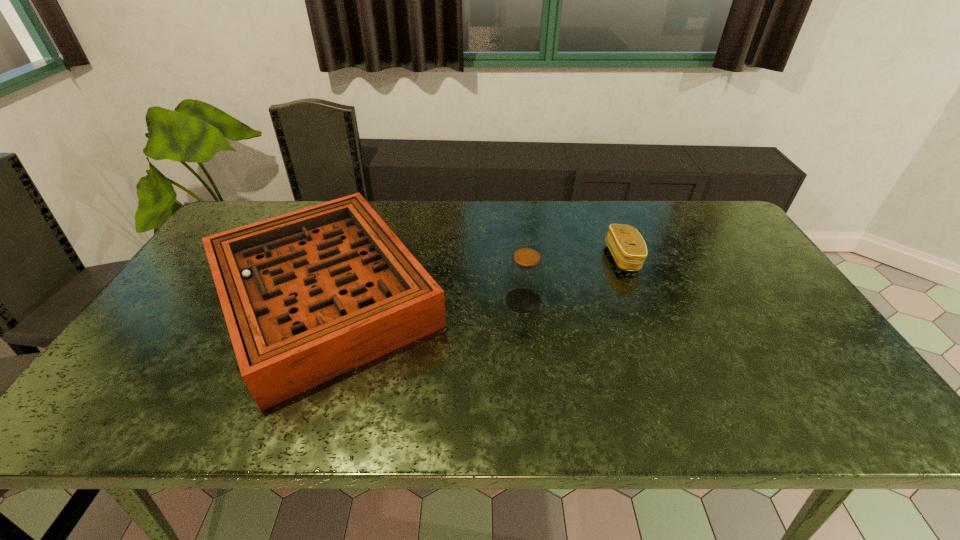
This screenshot has height=540, width=960. Identify the location of jar. (525, 275).

The width and height of the screenshot is (960, 540). What are the coordinates of `the tallest object` in the screenshot? It's located at pos(525,275).

This screenshot has height=540, width=960. Find the location of `the second shortest object`. the second shortest object is located at coordinates (309, 295).

Find the location of `gameboard`. gameboard is located at coordinates (309, 295).

Identify the location of clutch bag. The image size is (960, 540). (626, 244).

Find the location of a particular element. This screenshot has height=540, width=960. the shortest object is located at coordinates coord(626,244).

Find the location of a particular element. vacant space situated on the left of the jar is located at coordinates (420, 300).

Where is `vacant space located on the right of the leftmost object`? vacant space located on the right of the leftmost object is located at coordinates (518, 297).

Locate an element on the screen. free space located 0.090m on the zipper side of the clutch bag is located at coordinates (578, 258).

The width and height of the screenshot is (960, 540). What are the coordinates of `free space located 0.390m on the zipper side of the clutch bag` in the screenshot? It's located at (479, 258).